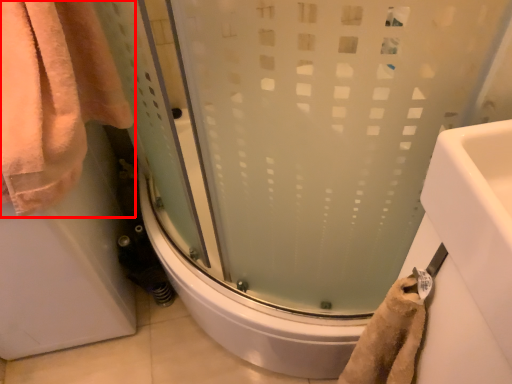
Question: From the image's perspective, what is the correct spatial relationship of towel (annotated by the red box) in relation to shower door?

Choices:
 (A) above
 (B) below

Answer: (A)